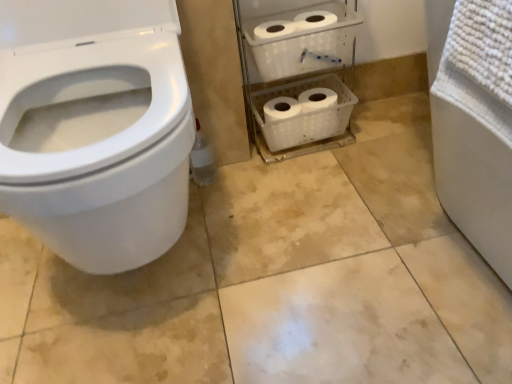
Question: Is white plastic shelf at center taller or shorter than white glossy toilet at left?

Choices:
 (A) tall
 (B) short

Answer: (B)

Question: From the image's perspective, relative to white glossy toilet at left, is white plastic shelf at center above or below?

Choices:
 (A) below
 (B) above

Answer: (B)

Question: Considering the relative positions of white plastic shelf at center and white glossy toilet at left in the image provided, is white plastic shelf at center to the left or to the right of white glossy toilet at left?

Choices:
 (A) left
 (B) right

Answer: (B)

Question: Is white glossy toilet at left spatially inside white plastic shelf at center, or outside of it?

Choices:
 (A) inside
 (B) outside

Answer: (B)

Question: In terms of size, does white glossy toilet at left appear bigger or smaller than white plastic shelf at center?

Choices:
 (A) small
 (B) big

Answer: (B)

Question: Is white glossy toilet at left taller or shorter than white plastic shelf at center?

Choices:
 (A) short
 (B) tall

Answer: (B)

Question: From the image's perspective, is white glossy toilet at left above or below white plastic shelf at center?

Choices:
 (A) below
 (B) above

Answer: (A)